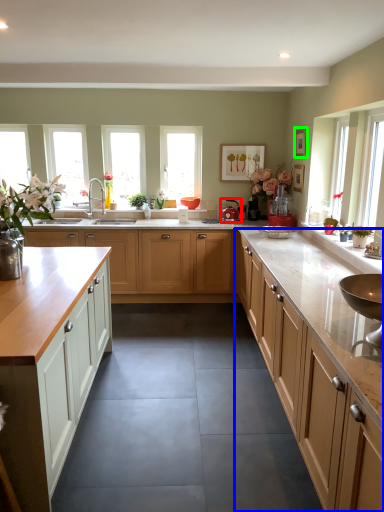
Question: Considering the real-world distances, which object is closest to appliance (highlighted by a red box)? cabinetry (highlighted by a blue box) or picture frame (highlighted by a green box).

Choices:
 (A) cabinetry
 (B) picture frame

Answer: (B)